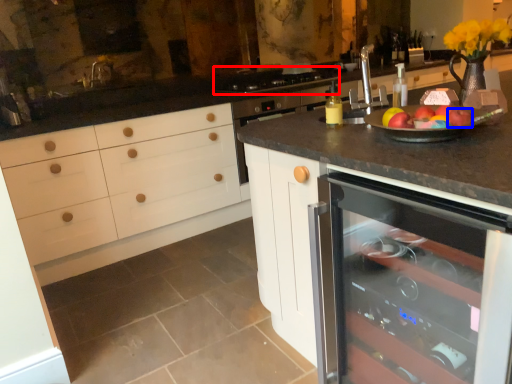
Question: Which object appears closest to the camera in this image, gas stove (highlighted by a red box) or apple (highlighted by a blue box)?

Choices:
 (A) gas stove
 (B) apple

Answer: (B)